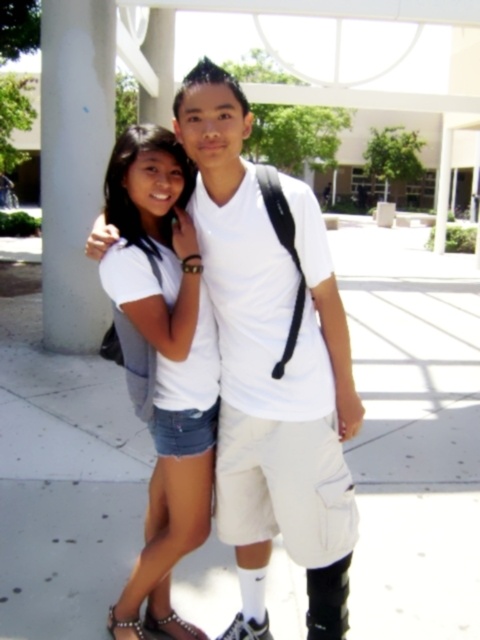
Can you confirm if denim shorts at center is positioned to the right of pearl-embellished sandal at lower left?

Correct, you'll find denim shorts at center to the right of pearl-embellished sandal at lower left.

The width and height of the screenshot is (480, 640). Find the location of `denim shorts at center`. denim shorts at center is located at coordinates (165, 348).

Who is more distant from viewer, (137,163) or (120,627)?

The point (120,627) is behind.

Find the location of a particular element. denim shorts at center is located at coordinates (165, 348).

Can you confirm if black studded sandal at lower left is positioned to the right of pearl-embellished sandal at lower left?

Correct, you'll find black studded sandal at lower left to the right of pearl-embellished sandal at lower left.

Which is in front, point (191, 632) or point (123, 625)?

Point (123, 625)

Locate an element on the screen. black studded sandal at lower left is located at coordinates (171, 627).

Does white cotton t-shirt at center have a greater width compared to pearl-embellished sandal at lower left?

Yes.

Can you confirm if white cotton t-shirt at center is thinner than pearl-embellished sandal at lower left?

No, white cotton t-shirt at center is not thinner than pearl-embellished sandal at lower left.

Is point (274, 355) behind point (140, 625)?

No, (274, 355) is closer to viewer.

In order to click on white cotton t-shirt at center in this screenshot , I will do `click(272, 365)`.